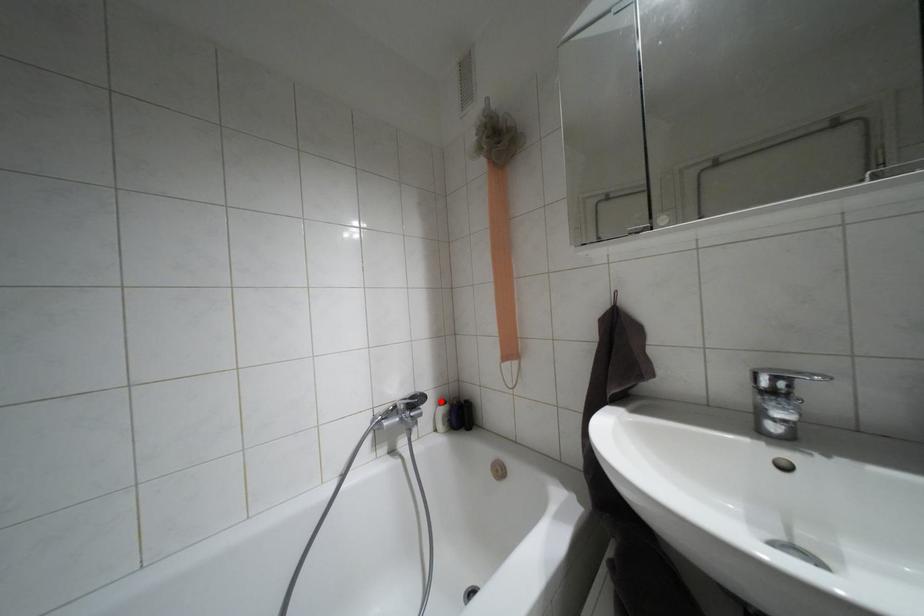
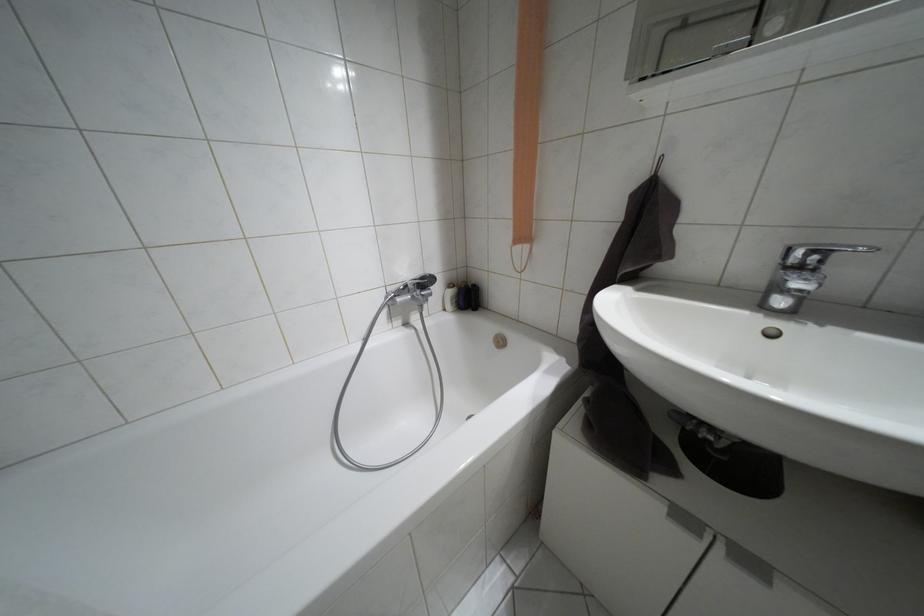
Question: I am providing you with two images of the same scene from different viewpoints. A red point is shown in image1. For the corresponding object point in image2, is it positioned nearer or farther from the camera?

Choices:
 (A) Nearer
 (B) Farther

Answer: (A)